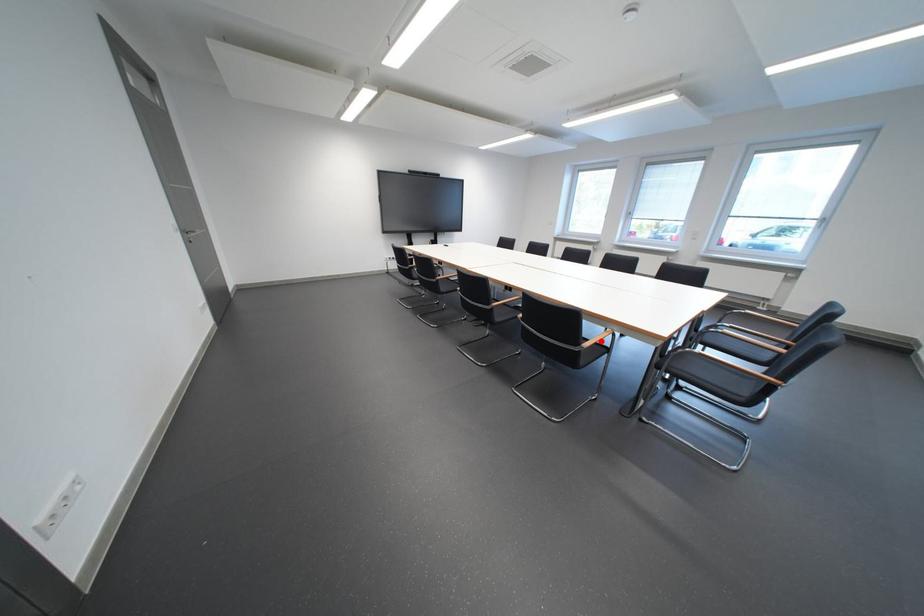
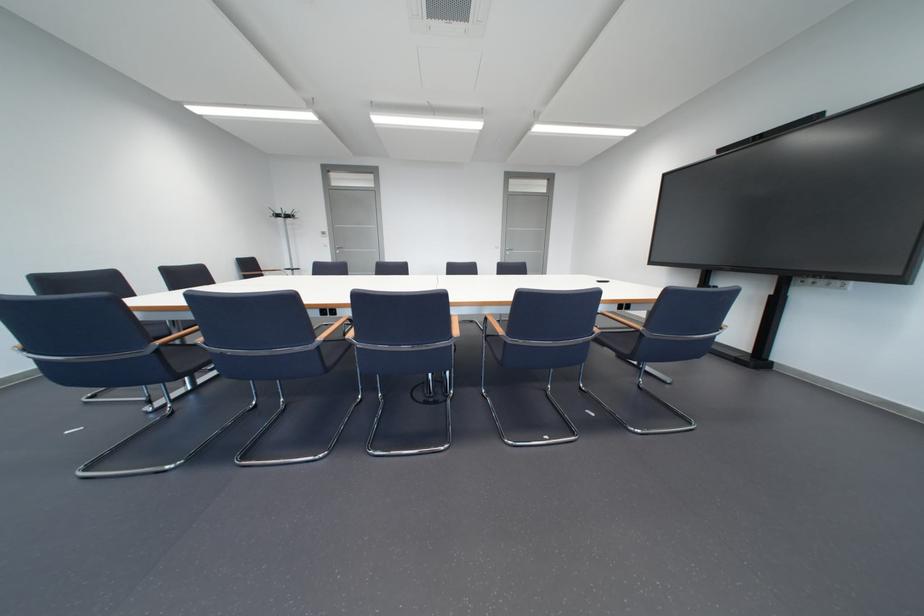
Question: I am providing you with two images of the same scene from different viewpoints. A red point is marked on the first image. At the location where the point appears in image 1, is it still visible in image 2?

Choices:
 (A) Yes
 (B) No

Answer: (B)